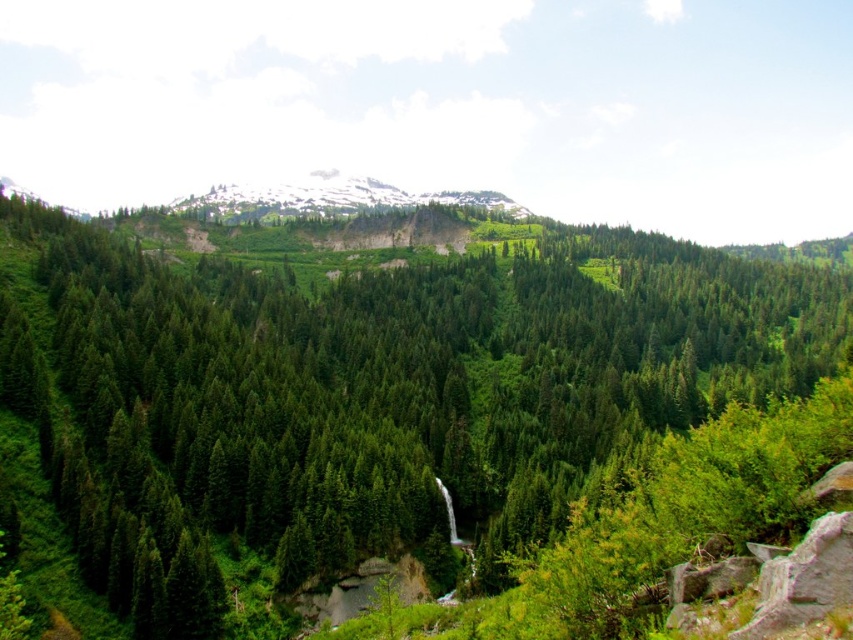
Question: Does green matte tree at center appear under snowy rocky mountain at upper center?

Choices:
 (A) yes
 (B) no

Answer: (A)

Question: Among these points, which one is farthest from the camera?

Choices:
 (A) (396, 188)
 (B) (78, 397)

Answer: (A)

Question: Is green matte tree at center above snowy rocky mountain at upper center?

Choices:
 (A) no
 (B) yes

Answer: (A)

Question: Among these points, which one is farthest from the camera?

Choices:
 (A) (714, 372)
 (B) (289, 205)

Answer: (B)

Question: Among these objects, which one is nearest to the camera?

Choices:
 (A) snowy rocky mountain at upper center
 (B) green matte tree at center

Answer: (B)

Question: Does green matte tree at center appear on the right side of snowy rocky mountain at upper center?

Choices:
 (A) no
 (B) yes

Answer: (B)